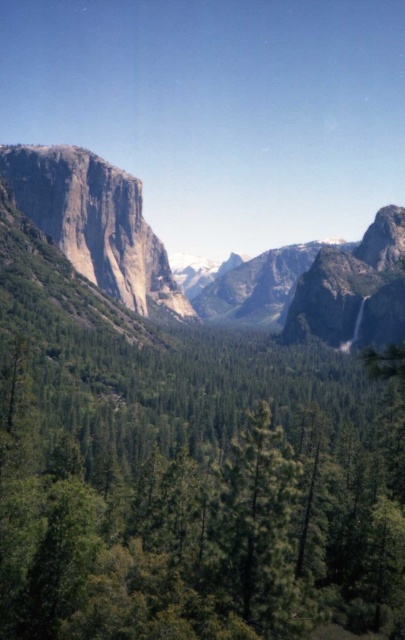
Image resolution: width=405 pixels, height=640 pixels. What do you see at coordinates (200, 524) in the screenshot?
I see `green matte tree at center` at bounding box center [200, 524].

Measure the distance between point (264, 616) and camera.

They are 50.05 meters apart.

Describe the element at coordinates (200, 524) in the screenshot. The image size is (405, 640). I see `green matte tree at center` at that location.

This screenshot has width=405, height=640. Find the location of `green matte tree at center`. green matte tree at center is located at coordinates (200, 524).

Which is above, green matte tree at center or rugged granite cliff at left?

Positioned higher is rugged granite cliff at left.

Is green matte tree at center behind rugged granite cliff at left?

That is False.

Image resolution: width=405 pixels, height=640 pixels. Describe the element at coordinates (200, 524) in the screenshot. I see `green matte tree at center` at that location.

I want to click on green matte tree at center, so tap(200, 524).

From the picture: Is gray rock formation at left taller than rugged granite cliff at left?

Yes.

Between gray rock formation at left and rugged granite cliff at left, which one appears on the right side from the viewer's perspective?

Positioned to the right is gray rock formation at left.

Locate an element on the screen. This screenshot has width=405, height=640. gray rock formation at left is located at coordinates (223, 275).

The height and width of the screenshot is (640, 405). In order to click on gray rock formation at left in this screenshot , I will do `click(223, 275)`.